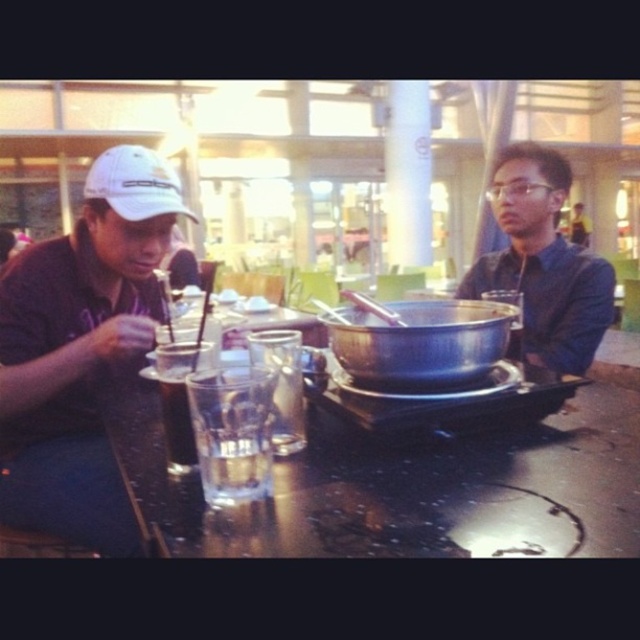
Consider the image. You are standing at the edge of the table and want to pick up both items located at point (577, 476) and point (8, 426). Which item should you pick up first to minimize the distance you have to move your hand?

You should pick up the item at point (577, 476) first because it is closer to the camera, meaning it is physically nearer to your hand when you reach for it compared to the item at point (8, 426).

You are trying to place a small coaster under the metallic reflective table at center to protect it from a hot beverage. Considering the size of the matte white cap at left, will the coaster fit under the table?

The metallic reflective table at center is smaller than the matte white cap at left. Since the coaster is meant for the table, its size should be appropriate for the table, not the cap. However, without knowing the coaster size relative to the table, we can only confirm the table is smaller than the cap. Please ensure the coaster matches the table dimensions.

You are a waiter trying to pick up the clear glass at center and the matte white cap at left. Which object should you grab first to avoid knocking over the other?

You should grab the matte white cap at left first because it is in front of the clear glass at center, so moving it first won not disturb the glass behind it.